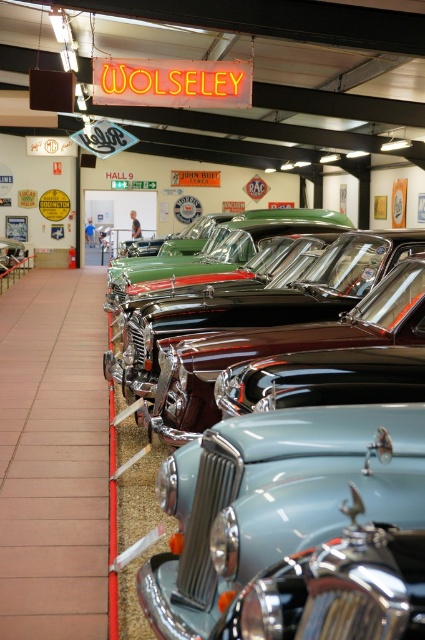
Question: Does satin teal car at center appear under light blue metallic car at center?

Choices:
 (A) no
 (B) yes

Answer: (B)

Question: Which of the following is the farthest from the observer?

Choices:
 (A) (118, 628)
 (B) (322, 483)

Answer: (A)

Question: Which point is closer to the camera?

Choices:
 (A) coord(224,488)
 (B) coord(234,308)

Answer: (A)

Question: Does satin teal car at center appear under light blue metallic car at center?

Choices:
 (A) yes
 (B) no

Answer: (A)

Question: Can you confirm if satin teal car at center is positioned above light blue metallic car at center?

Choices:
 (A) no
 (B) yes

Answer: (A)

Question: Which of the following is the farthest from the observer?

Choices:
 (A) (263, 300)
 (B) (323, 461)

Answer: (A)